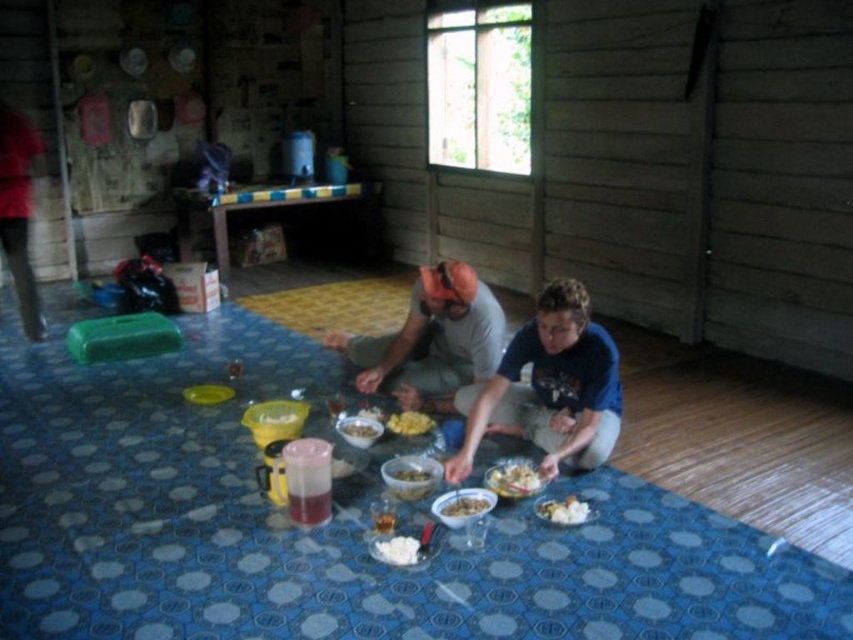
Which of these two, blue cotton shirt at center or white matte rice at center, stands taller?

Standing taller between the two is blue cotton shirt at center.

Is blue cotton shirt at center thinner than white matte rice at center?

Incorrect, blue cotton shirt at center's width is not less than white matte rice at center's.

Is point (527, 353) positioned behind point (515, 480)?

Yes, it is.

Locate an element on the screen. This screenshot has width=853, height=640. blue cotton shirt at center is located at coordinates (550, 387).

Which is in front, point (421, 458) or point (404, 468)?

Positioned in front is point (404, 468).

You are a GUI agent. You are given a task and a screenshot of the screen. Output one action in this format:
    pyautogui.click(x=<x>, y=<y>)
    Task: Click on the shiny plastic bowl at center
    Image resolution: width=853 pixels, height=640 pixels.
    Given the screenshot: What is the action you would take?
    pyautogui.click(x=410, y=476)

Image resolution: width=853 pixels, height=640 pixels. I want to click on shiny plastic bowl at center, so click(410, 476).

Does wooden table at center appear on the left side of white matte rice at lower center?

Correct, you'll find wooden table at center to the left of white matte rice at lower center.

Measure the distance from wooden table at center to white matte rice at lower center.

A distance of 4.44 meters exists between wooden table at center and white matte rice at lower center.

Between point (224, 266) and point (556, 518), which one is positioned behind?

Point (224, 266)

Where is `wooden table at center`? This screenshot has height=640, width=853. wooden table at center is located at coordinates (271, 205).